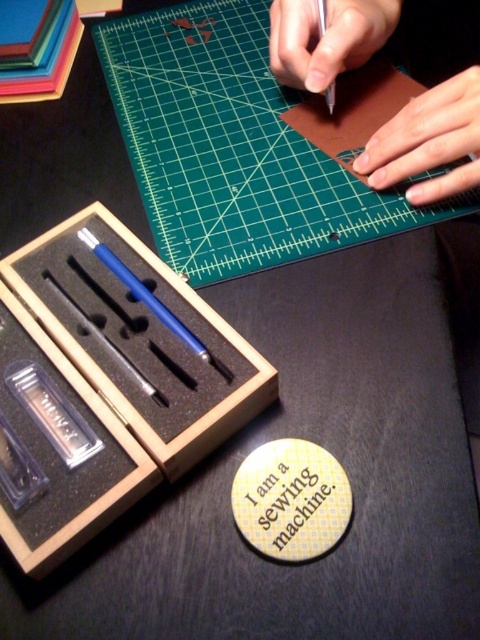
Question: Is smooth leather hands at upper right bigger than smooth skin at upper right?

Choices:
 (A) no
 (B) yes

Answer: (B)

Question: Is green rubber ruler at upper center further to the viewer compared to smooth skin at upper right?

Choices:
 (A) no
 (B) yes

Answer: (B)

Question: Which of these objects is positioned farthest from the wooden box at lower left?

Choices:
 (A) smooth skin hand at upper center
 (B) smooth leather hands at upper right
 (C) green rubber ruler at upper center

Answer: (A)

Question: Which point is farther from the camera taking this photo?

Choices:
 (A) (420, 195)
 (B) (291, 12)

Answer: (B)

Question: From the image, what is the correct spatial relationship of smooth leather hands at upper right in relation to smooth skin at upper right?

Choices:
 (A) below
 (B) above

Answer: (B)

Question: Which object is positioned closest to the smooth skin hand at upper center?

Choices:
 (A) wooden box at lower left
 (B) smooth leather hands at upper right
 (C) smooth skin at upper right
 (D) green rubber ruler at upper center

Answer: (B)